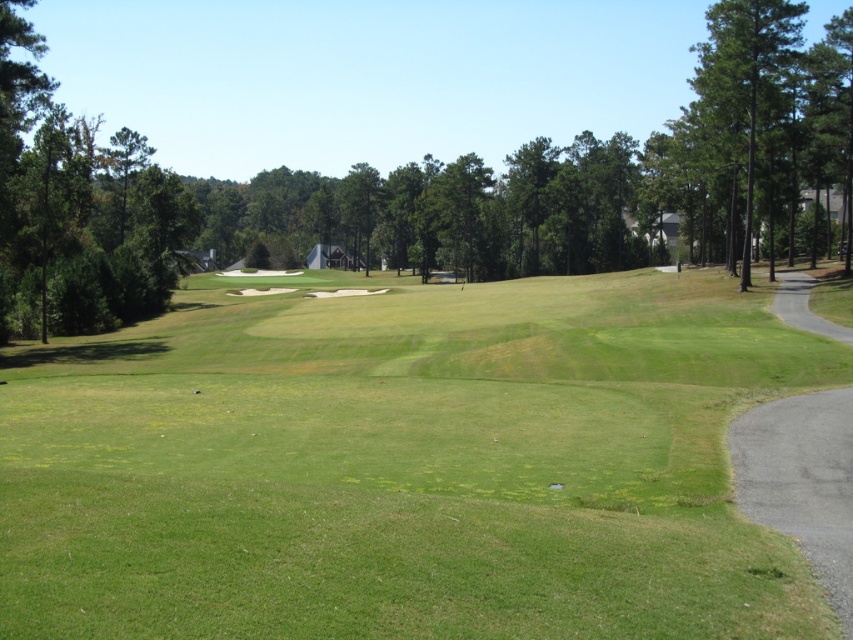
Question: Based on their relative distances, which object is nearer to the green leafy tree at center?

Choices:
 (A) green leafy tree at left
 (B) green grassy field at center

Answer: (A)

Question: Does green leafy tree at center have a lesser width compared to green leafy tree at left?

Choices:
 (A) no
 (B) yes

Answer: (A)

Question: Does green grassy field at center have a greater width compared to green leafy tree at center?

Choices:
 (A) no
 (B) yes

Answer: (A)

Question: Can you confirm if green leafy tree at center is positioned to the right of green leafy tree at left?

Choices:
 (A) yes
 (B) no

Answer: (A)

Question: Estimate the real-world distances between objects in this image. Which object is closer to the green leafy tree at left?

Choices:
 (A) green grassy field at center
 (B) green leafy tree at center

Answer: (A)

Question: Which point is farther to the camera?

Choices:
 (A) (381, 177)
 (B) (1, 300)
 (C) (659, 477)

Answer: (A)